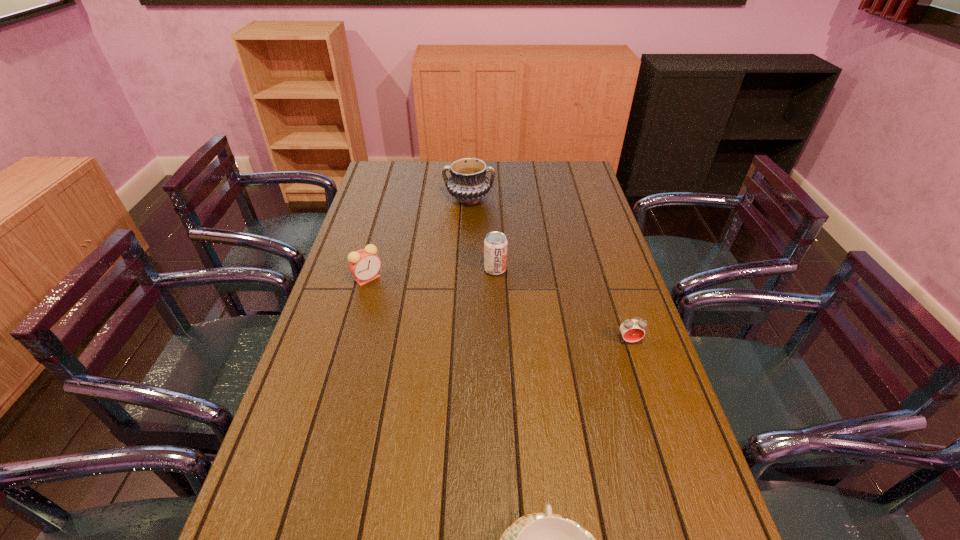
What are the coordinates of `free space between the nearer alarm clock and the taller alarm clock` in the screenshot? It's located at (498, 309).

The height and width of the screenshot is (540, 960). In order to click on blank region between the soda can and the nearer alarm clock in this screenshot , I will do `click(562, 305)`.

The width and height of the screenshot is (960, 540). In order to click on object that is the closest to the farthest object in this screenshot , I will do `click(495, 244)`.

Locate an element on the screen. The width and height of the screenshot is (960, 540). object that ranks as the closest to the soda can is located at coordinates (468, 183).